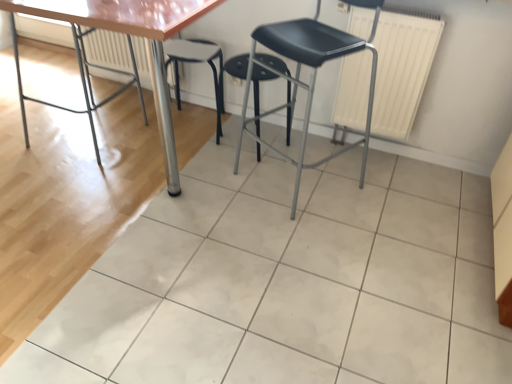
The height and width of the screenshot is (384, 512). What are the coordinates of `unoccupied space behind metallic polished table at left` in the screenshot? It's located at (84, 97).